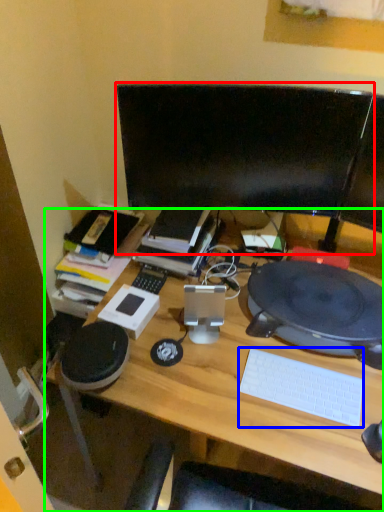
Question: Estimate the real-world distances between objects in this image. Which object is farther from computer monitor (highlighted by a red box), computer keyboard (highlighted by a blue box) or desk (highlighted by a green box)?

Choices:
 (A) computer keyboard
 (B) desk

Answer: (A)